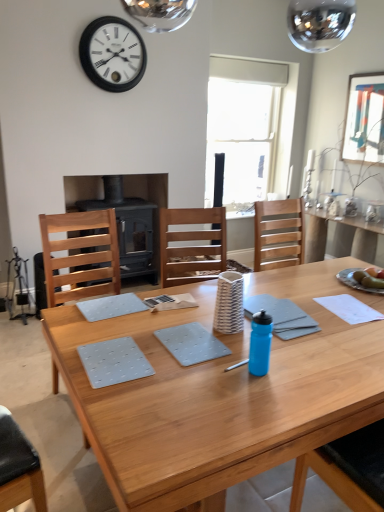
Find the location of `free space in front of light gray fabric placemat at center, which is counted as the 2th place mat, starting from the front`. free space in front of light gray fabric placemat at center, which is counted as the 2th place mat, starting from the front is located at coordinates [x=104, y=331].